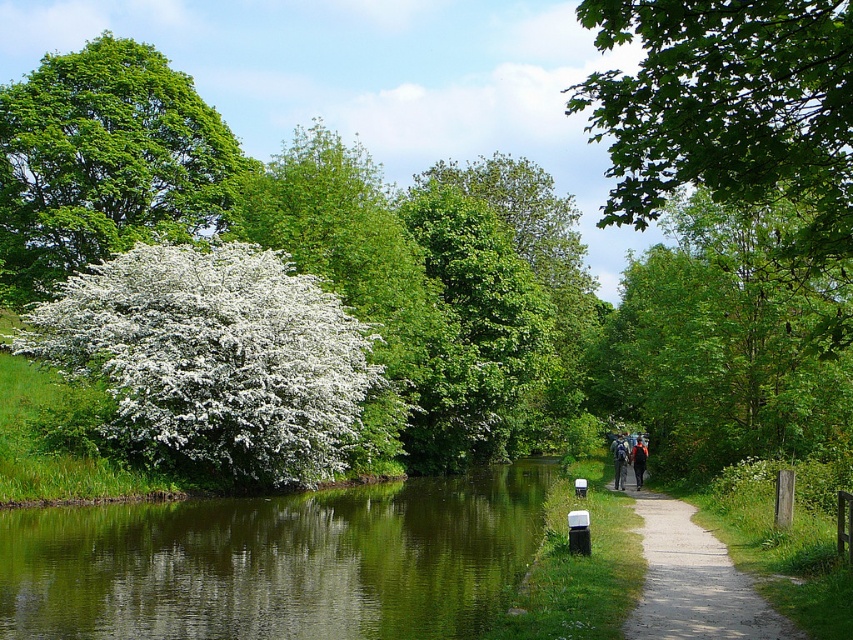
You are standing on the path near the canal and want to take a photo of the green leafy tree at upper right and the green reflective water at center. Which object should you focus on first if you want both to be in sharp focus?

You should focus on the green leafy tree at upper right first because it is farther away from you than the green reflective water at center, so adjusting focus starting from the distant object ensures both can be in focus.

You are standing at the center of the canal and want to reach the white fluffy bush at left. Which direction should you move in to get there?

You should move to the left to reach the white fluffy bush at left since it is located on the left side of the canal.

You are standing on the path next to the canal and want to take a photo of both the green reflective water at center and the green leafy tree at upper right. Can you fit both in the frame without moving your camera?

The green reflective water at center is shorter than the green leafy tree at upper right, so if the tree is taller, it might extend beyond the frame if the water is lower in the shot. However, since both are in the same scene and the path is next to the canal, adjusting the camera angle slightly downward could include both elements within the frame.